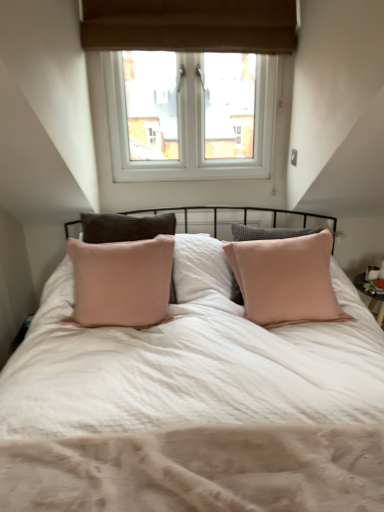
Describe the element at coordinates (199, 470) in the screenshot. This screenshot has height=512, width=384. I see `beige textured mattress at center` at that location.

Image resolution: width=384 pixels, height=512 pixels. I want to click on beige textured mattress at center, so [199, 470].

In order to face white plastic window at upper center, should I rotate leftwards or rightwards?

Turn left approximately 0.156 degrees to face it.

Locate an element on the screen. The width and height of the screenshot is (384, 512). white plastic window at upper center is located at coordinates (189, 83).

Describe the element at coordinates (189, 83) in the screenshot. I see `white plastic window at upper center` at that location.

Find the location of a particular element. beige textured mattress at center is located at coordinates (199, 470).

Does beige textured mattress at center appear on the left side of white plastic window at upper center?

No, beige textured mattress at center is not to the left of white plastic window at upper center.

Does beige textured mattress at center come behind white plastic window at upper center?

No, the depth of beige textured mattress at center is less than that of white plastic window at upper center.

Is point (83, 495) farther from viewer compared to point (258, 120)?

No, it is not.

From the image's perspective, which object appears higher, beige textured mattress at center or white plastic window at upper center?

white plastic window at upper center.

From a real-world perspective, which is physically above, beige textured mattress at center or white plastic window at upper center?

white plastic window at upper center, from a real-world perspective.

Which of these two, beige textured mattress at center or white plastic window at upper center, is thinner?

white plastic window at upper center is thinner.

Who is taller, beige textured mattress at center or white plastic window at upper center?

With more height is white plastic window at upper center.

Considering the sizes of beige textured mattress at center and white plastic window at upper center in the image, is beige textured mattress at center bigger or smaller than white plastic window at upper center?

Considering their sizes, beige textured mattress at center takes up less space than white plastic window at upper center.

Would you say beige textured mattress at center is inside or outside white plastic window at upper center?

beige textured mattress at center is located beyond the bounds of white plastic window at upper center.

Is beige textured mattress at center in contact with white plastic window at upper center?

They are not placed beside each other.

Is beige textured mattress at center oriented towards white plastic window at upper center?

No, beige textured mattress at center does not turn towards white plastic window at upper center.

How many degrees apart are the facing directions of beige textured mattress at center and white plastic window at upper center?

They differ by 0.000489 degrees in their facing directions.

How much distance is there between beige textured mattress at center and white plastic window at upper center?

The distance of beige textured mattress at center from white plastic window at upper center is 1.95 meters.

The width and height of the screenshot is (384, 512). What are the coordinates of `mattress that appears below the white plastic window at upper center (from the image's perspective)` in the screenshot? It's located at (199, 470).

Can you confirm if white plastic window at upper center is positioned to the left of beige textured mattress at center?

Yes.

Does white plastic window at upper center lie behind beige textured mattress at center?

Yes, the depth of white plastic window at upper center is greater than that of beige textured mattress at center.

Which is closer, (219, 125) or (279, 474)?

The point (279, 474) is closer to the camera.

From the image's perspective, relative to beige textured mattress at center, is white plastic window at upper center above or below?

white plastic window at upper center is above beige textured mattress at center.

From a real-world perspective, is white plastic window at upper center over beige textured mattress at center?

Yes.

Is white plastic window at upper center wider or thinner than beige textured mattress at center?

white plastic window at upper center is thinner than beige textured mattress at center.

In terms of height, does white plastic window at upper center look taller or shorter compared to beige textured mattress at center?

white plastic window at upper center is taller than beige textured mattress at center.

Looking at this image, does white plastic window at upper center have a larger size compared to beige textured mattress at center?

→ Yes, white plastic window at upper center is bigger than beige textured mattress at center.

Consider the image. Could beige textured mattress at center be considered to be inside white plastic window at upper center?

That's incorrect, beige textured mattress at center is not inside white plastic window at upper center.

Would you say white plastic window at upper center is a long distance from beige textured mattress at center?

Yes, white plastic window at upper center is far from beige textured mattress at center.

Based on the photo, could you tell me if white plastic window at upper center is turned towards beige textured mattress at center?

Yes.

Identify the location of window above the beige textured mattress at center (from the image's perspective). (189, 83).

Where is `window that appears above the beige textured mattress at center (from a real-world perspective)`? window that appears above the beige textured mattress at center (from a real-world perspective) is located at coordinates (189, 83).

At what (x,y) coordinates should I click in order to perform the action: click on mattress on the right of white plastic window at upper center. Please return your answer as a coordinate pair (x, y). This screenshot has width=384, height=512. Looking at the image, I should click on pos(199,470).